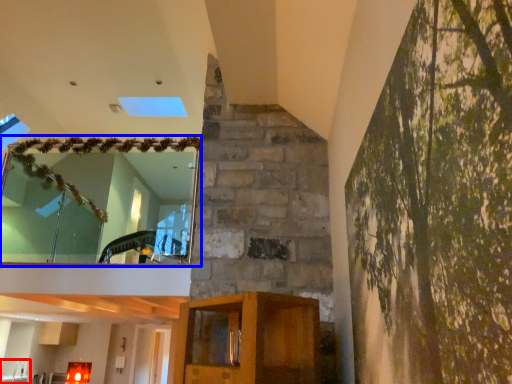
Question: Which object is closer to the camera taking this photo, sink (highlighted by a red box) or window (highlighted by a blue box)?

Choices:
 (A) sink
 (B) window

Answer: (B)